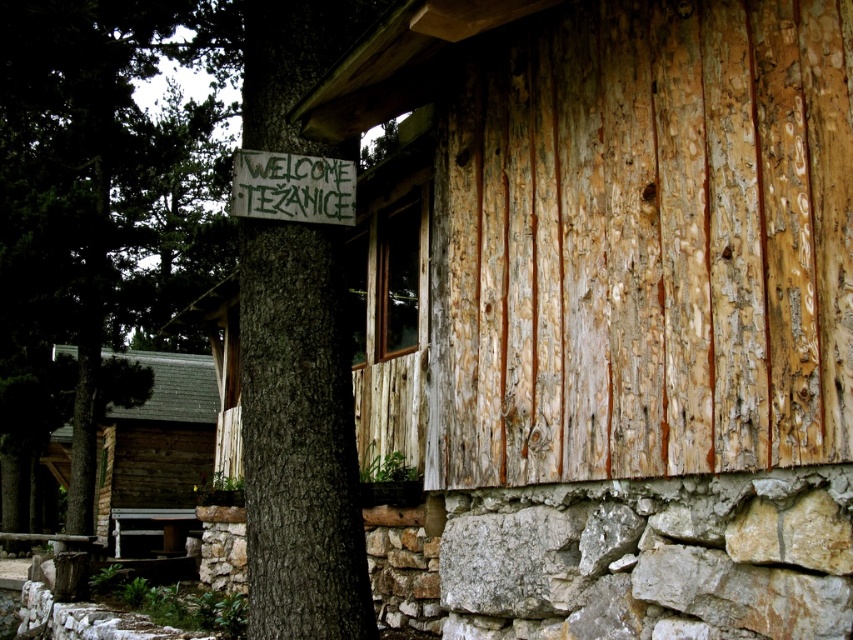
Consider the image. You are standing in front of the brown wooden log cabin at left and looking up. Do you see the green painted wood sign at upper center above the cabin?

Yes, the brown wooden log cabin at left is positioned under the green painted wood sign at upper center, so when looking up from the cabin, the sign is directly above it.

You are standing in front of the brown wooden log cabin at left and want to hang a new sign above the green painted wood sign at upper center. Can you reach the spot where you want to hang the new sign?

The brown wooden log cabin at left is closer to you than the green painted wood sign at upper center, so you can reach the spot above the green painted wood sign at upper center.

You are standing in front of the cabin and notice the green rough bark tree at left and the green painted wood sign at upper center. Which object is taller?

The green rough bark tree at left is much taller than the green painted wood sign at upper center.